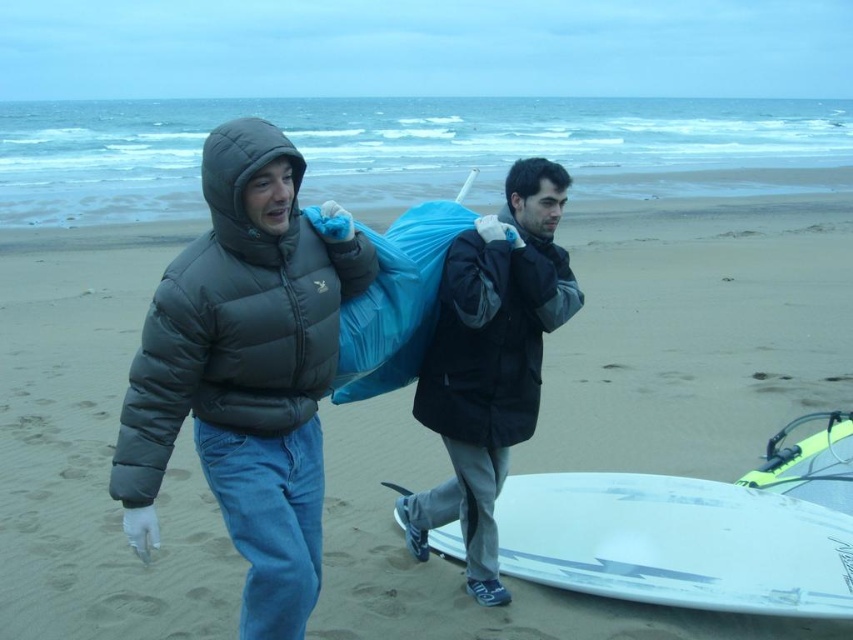
What do you see at coordinates (686, 538) in the screenshot? Image resolution: width=853 pixels, height=640 pixels. I see `white glossy surfboard at lower center` at bounding box center [686, 538].

Who is more forward, (463, 548) or (494, 248)?

Positioned in front is point (494, 248).

Is point (747, 568) closer to viewer compared to point (476, 381)?

Yes, it is in front of point (476, 381).

Locate an element on the screen. This screenshot has width=853, height=640. white glossy surfboard at lower center is located at coordinates (686, 538).

Who is positioned more to the right, dark gray puffer jacket at center or dark gray matte jacket at center?

dark gray matte jacket at center

Based on the photo, can you confirm if dark gray puffer jacket at center is positioned below dark gray matte jacket at center?

No, dark gray puffer jacket at center is not below dark gray matte jacket at center.

What do you see at coordinates (486, 397) in the screenshot? I see `dark gray puffer jacket at center` at bounding box center [486, 397].

Where is `dark gray puffer jacket at center`? This screenshot has height=640, width=853. dark gray puffer jacket at center is located at coordinates (486, 397).

Is point (558, 474) behind point (511, 244)?

Yes, it is.

Is white glossy surfboard at lower center to the left of dark gray matte jacket at center from the viewer's perspective?

Incorrect, white glossy surfboard at lower center is not on the left side of dark gray matte jacket at center.

This screenshot has height=640, width=853. Describe the element at coordinates (686, 538) in the screenshot. I see `white glossy surfboard at lower center` at that location.

At what (x,y) coordinates should I click in order to perform the action: click on white glossy surfboard at lower center. Please return your answer as a coordinate pair (x, y). The image size is (853, 640). Looking at the image, I should click on (686, 538).